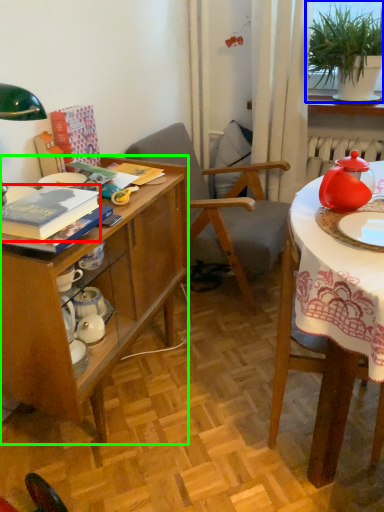
Question: Based on their relative distances, which object is nearer to book (highlighted by a red box)? Choose from houseplant (highlighted by a blue box) and desk (highlighted by a green box).

Choices:
 (A) houseplant
 (B) desk

Answer: (B)